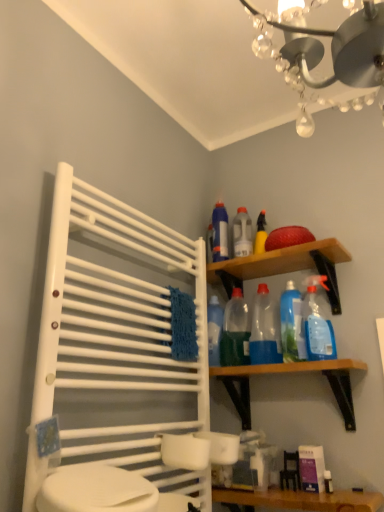
Identify the location of free space between blue plastic spray bottle at upper right, which appears as the 1th cleaning product when viewed from the left, and translucent plastic bottle at upper center, the 1th bottle in the back-to-front sequence. (236, 266).